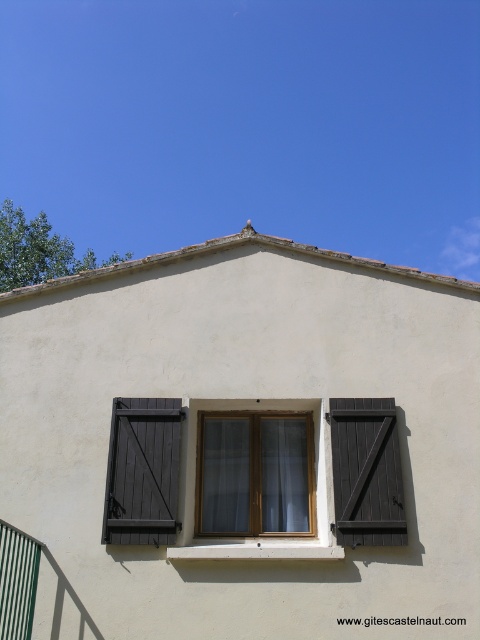
Identify the location of dark wood shutters at left. (143, 472).

Which of these two, matte wood window at center or green striped rail at lower left, stands shorter?

With less height is green striped rail at lower left.

Which is behind, point (236, 461) or point (19, 540)?

Positioned behind is point (236, 461).

At what (x,y) coordinates should I click in order to perform the action: click on matte wood window at center. Please return your answer as a coordinate pair (x, y). This screenshot has height=640, width=480. Looking at the image, I should click on (254, 474).

Can you confirm if matte wood window at center is positioned to the right of dark wood shutters at center?

Incorrect, matte wood window at center is not on the right side of dark wood shutters at center.

Is matte wood window at center positioned at the back of dark wood shutters at center?

Yes.

Where is `matte wood window at center`? The image size is (480, 640). matte wood window at center is located at coordinates (254, 474).